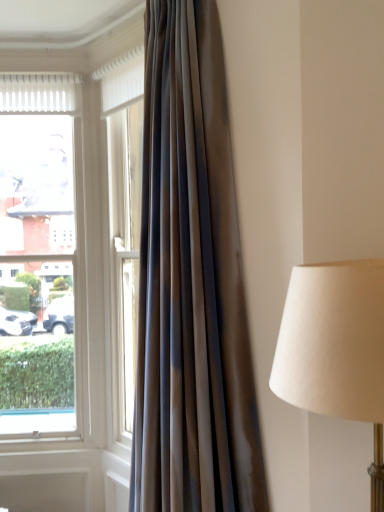
Question: Is satin-like brown curtain at left positioned in front of clear glass window at left?

Choices:
 (A) no
 (B) yes

Answer: (B)

Question: Is satin-like brown curtain at left not within clear glass window at left?

Choices:
 (A) yes
 (B) no

Answer: (A)

Question: Does satin-like brown curtain at left have a greater width compared to clear glass window at left?

Choices:
 (A) no
 (B) yes

Answer: (B)

Question: From the image's perspective, is satin-like brown curtain at left beneath clear glass window at left?

Choices:
 (A) yes
 (B) no

Answer: (B)

Question: Could you tell me if satin-like brown curtain at left is facing clear glass window at left?

Choices:
 (A) no
 (B) yes

Answer: (A)

Question: From a real-world perspective, is satin-like brown curtain at left located higher than clear glass window at left?

Choices:
 (A) yes
 (B) no

Answer: (A)

Question: Considering the relative sizes of clear glass window at left and satin-like brown curtain at left in the image provided, is clear glass window at left smaller than satin-like brown curtain at left?

Choices:
 (A) no
 (B) yes

Answer: (B)

Question: Considering the relative sizes of clear glass window at left and satin-like brown curtain at left in the image provided, is clear glass window at left bigger than satin-like brown curtain at left?

Choices:
 (A) no
 (B) yes

Answer: (A)

Question: Considering the relative sizes of clear glass window at left and satin-like brown curtain at left in the image provided, is clear glass window at left thinner than satin-like brown curtain at left?

Choices:
 (A) yes
 (B) no

Answer: (A)

Question: Is clear glass window at left not inside satin-like brown curtain at left?

Choices:
 (A) no
 (B) yes

Answer: (B)

Question: Is clear glass window at left facing towards satin-like brown curtain at left?

Choices:
 (A) no
 (B) yes

Answer: (A)

Question: Considering the relative sizes of clear glass window at left and satin-like brown curtain at left in the image provided, is clear glass window at left wider than satin-like brown curtain at left?

Choices:
 (A) yes
 (B) no

Answer: (B)

Question: Is clear glass window at left in front of or behind satin-like brown curtain at left in the image?

Choices:
 (A) behind
 (B) front

Answer: (A)